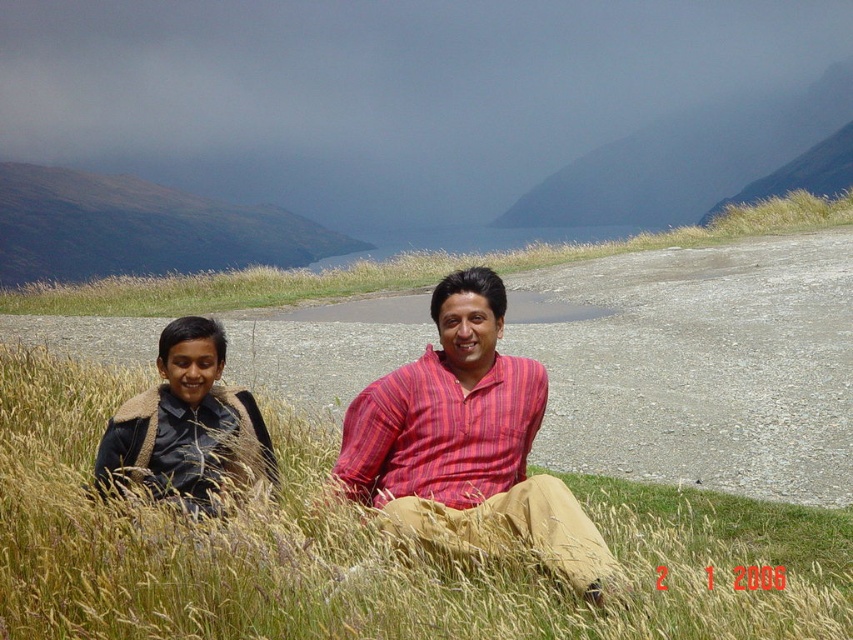
Is green grassy hillside at upper left positioned in front of grassy at center?

No, green grassy hillside at upper left is further to the viewer.

Can you confirm if green grassy hillside at upper left is smaller than grassy at center?

Yes.

This screenshot has width=853, height=640. What are the coordinates of `green grassy hillside at upper left` in the screenshot? It's located at (140, 228).

Between striped cotton shirt at center and smooth grassy hillside at upper center, which one is positioned lower?

striped cotton shirt at center is below.

How far apart are striped cotton shirt at center and smooth grassy hillside at upper center?

The distance of striped cotton shirt at center from smooth grassy hillside at upper center is 33.44 meters.

Describe the element at coordinates (466, 444) in the screenshot. This screenshot has height=640, width=853. I see `striped cotton shirt at center` at that location.

Find the location of `striped cotton shirt at center`. striped cotton shirt at center is located at coordinates (466, 444).

Which is below, grassy at center or black leather jacket at left?

black leather jacket at left is lower down.

Can you confirm if grassy at center is positioned below black leather jacket at left?

Incorrect, grassy at center is not positioned below black leather jacket at left.

Who is more distant from viewer, (544, 259) or (166, 336)?

Positioned behind is point (544, 259).

I want to click on grassy at center, so click(x=395, y=268).